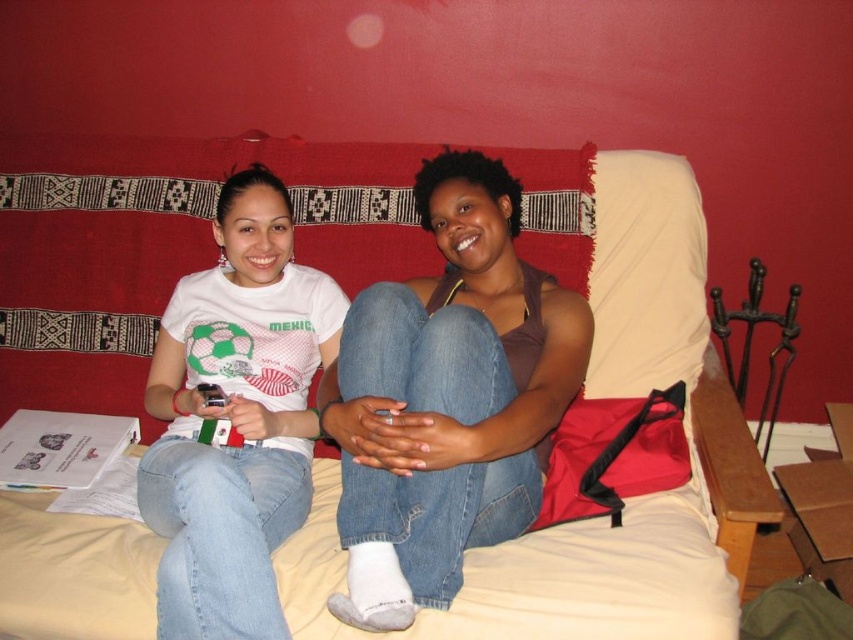
Can you confirm if beige fabric bed at center is positioned above white fabric pillow at upper center?

No.

Which of these two, beige fabric bed at center or white fabric pillow at upper center, stands shorter?

white fabric pillow at upper center is shorter.

Is point (695, 620) positioned behind point (628, 237)?

No, (695, 620) is in front of (628, 237).

You are a GUI agent. You are given a task and a screenshot of the screen. Output one action in this format:
    pyautogui.click(x=<x>, y=<y>)
    Task: Click on the beige fabric bed at center
    The width and height of the screenshot is (853, 640).
    Given the screenshot: What is the action you would take?
    click(544, 577)

Between beige fabric bed at center and brown matte tank top at center, which one is positioned lower?

Positioned lower is brown matte tank top at center.

What do you see at coordinates (544, 577) in the screenshot?
I see `beige fabric bed at center` at bounding box center [544, 577].

Identify the location of beige fabric bed at center. The height and width of the screenshot is (640, 853). (544, 577).

Does brown matte tank top at center appear on the left side of white matte t-shirt at center?

No, brown matte tank top at center is not to the left of white matte t-shirt at center.

Does brown matte tank top at center appear over white matte t-shirt at center?

Yes.

Is point (344, 596) less distant than point (200, 300)?

Yes, it is.

You are a GUI agent. You are given a task and a screenshot of the screen. Output one action in this format:
    pyautogui.click(x=<x>, y=<y>)
    Task: Click on the brown matte tank top at center
    
    Given the screenshot: What is the action you would take?
    pyautogui.click(x=447, y=397)